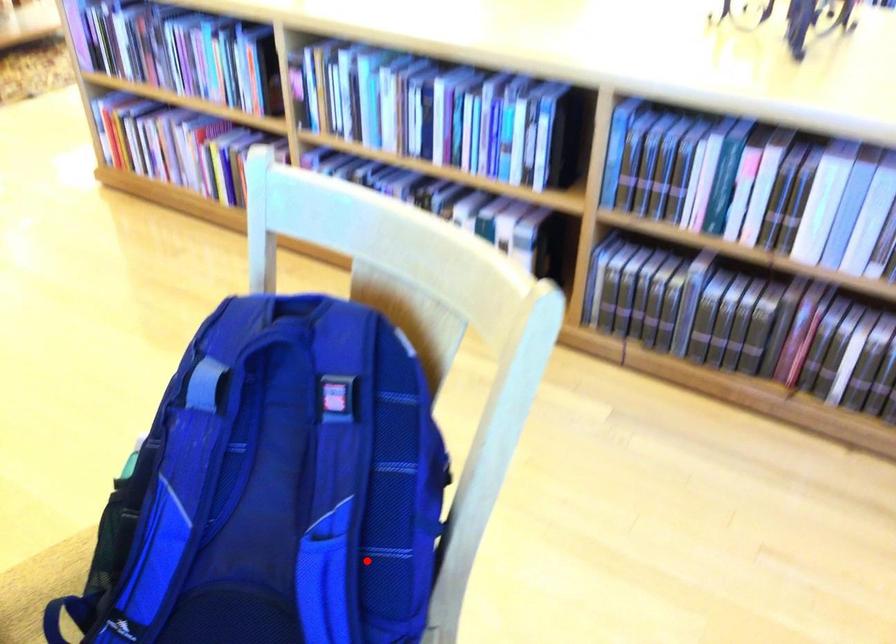
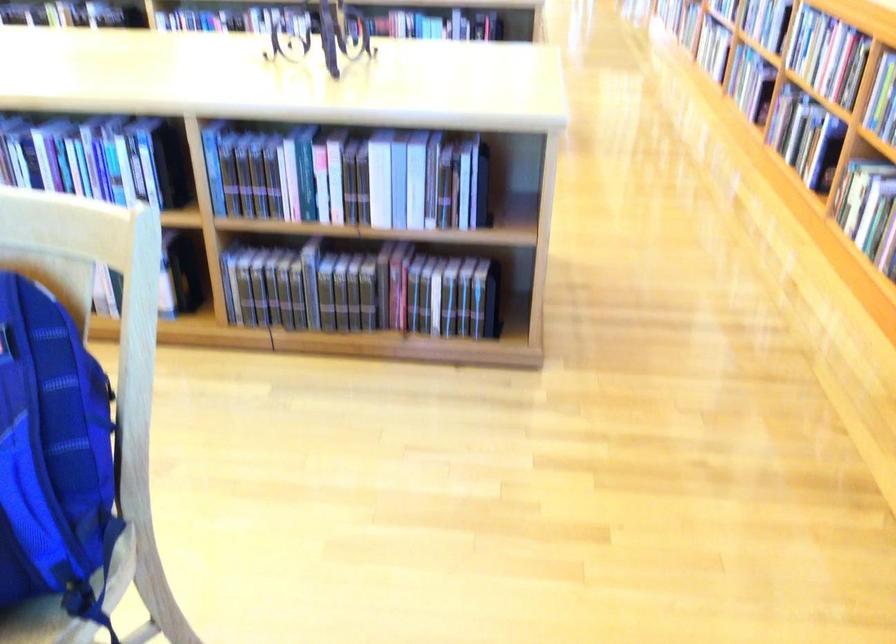
Question: I am providing you with two images of the same scene from different viewpoints. Given a red point in image1, look at the same physical point in image2. Is it:

Choices:
 (A) Closer to the viewpoint
 (B) Farther from the viewpoint

Answer: (B)